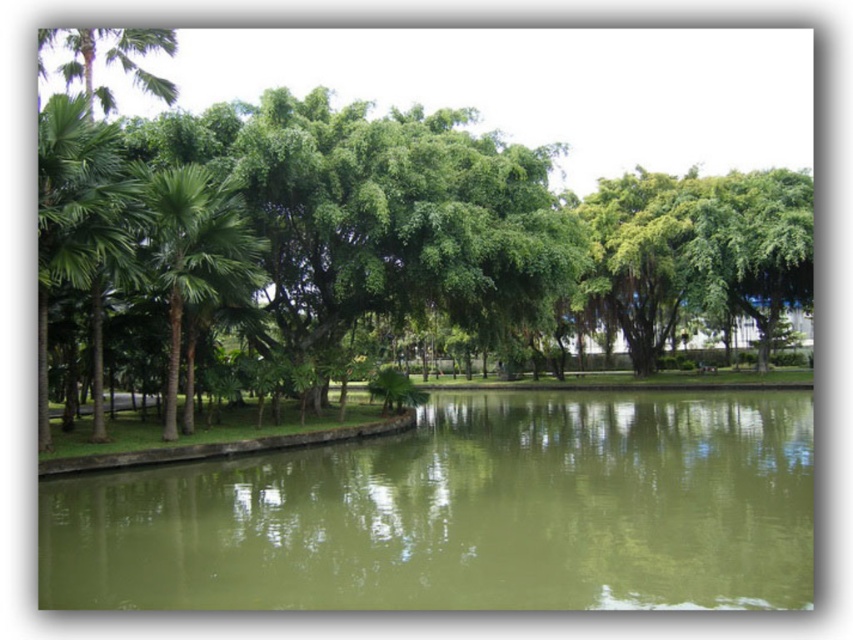
Who is positioned more to the right, green murky water at center or green leafy palm tree at left?

green murky water at center is more to the right.

Looking at this image, is green murky water at center below green leafy palm tree at left?

Correct, green murky water at center is located below green leafy palm tree at left.

Which is behind, point (492, 436) or point (242, 273)?

The point (492, 436) is more distant.

This screenshot has width=853, height=640. Find the location of `green murky water at center`. green murky water at center is located at coordinates (463, 513).